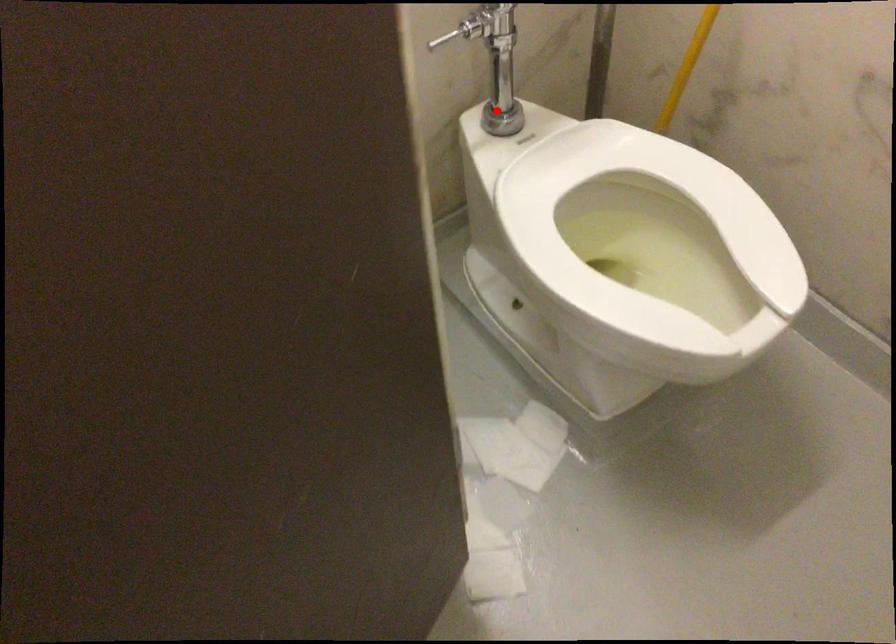
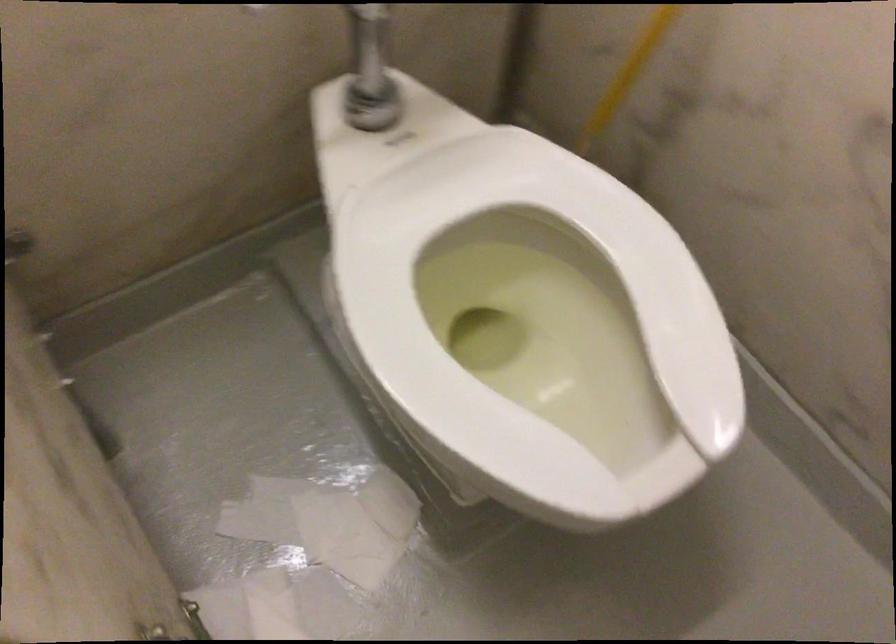
Question: I am providing you with two images of the same scene from different viewpoints. Given a red point in image1, look at the same physical point in image2. Is it:

Choices:
 (A) Closer to the viewpoint
 (B) Farther from the viewpoint

Answer: (A)